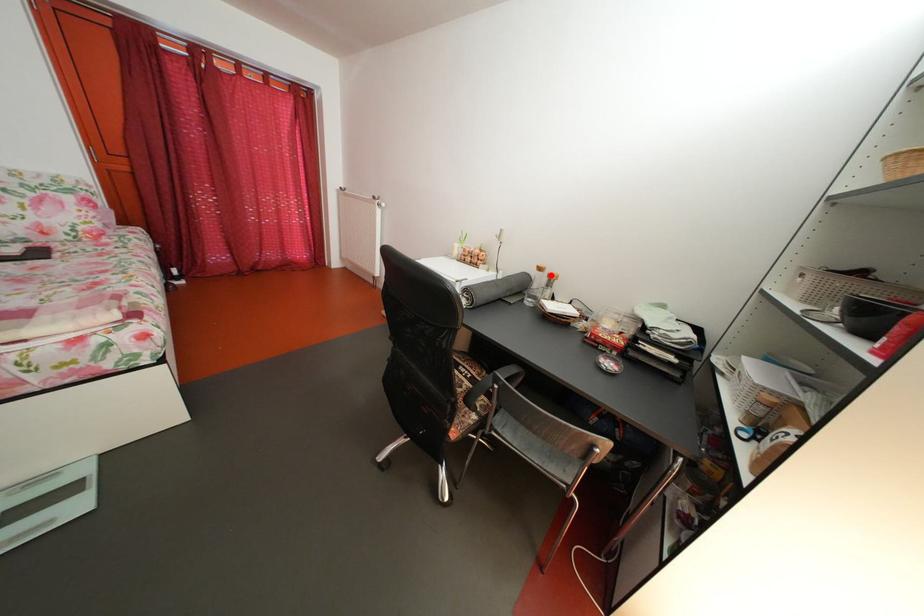
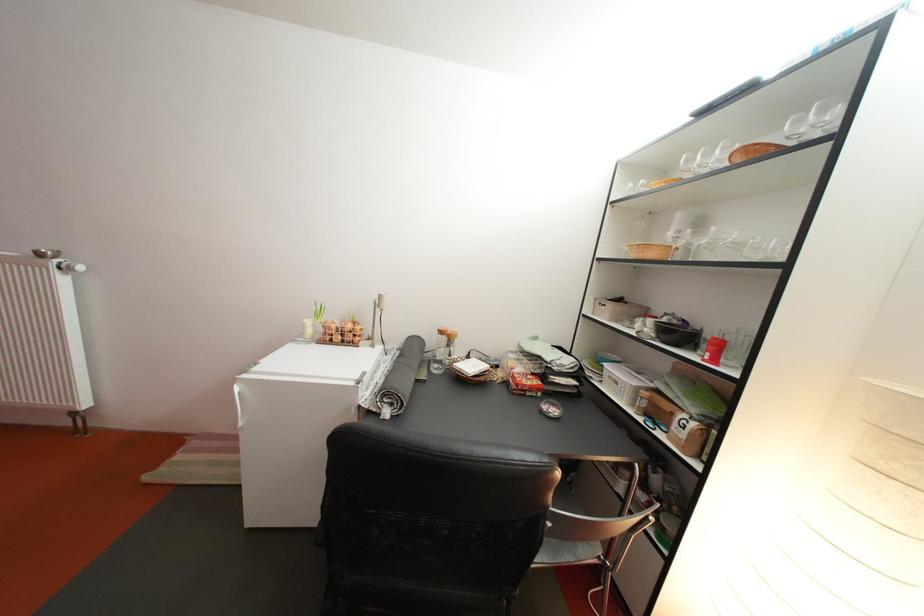
Question: I am providing you with two images of the same scene from different viewpoints. A red point is marked on the first image. Can you still see the location of the red point in image 2?

Choices:
 (A) Yes
 (B) No

Answer: (A)